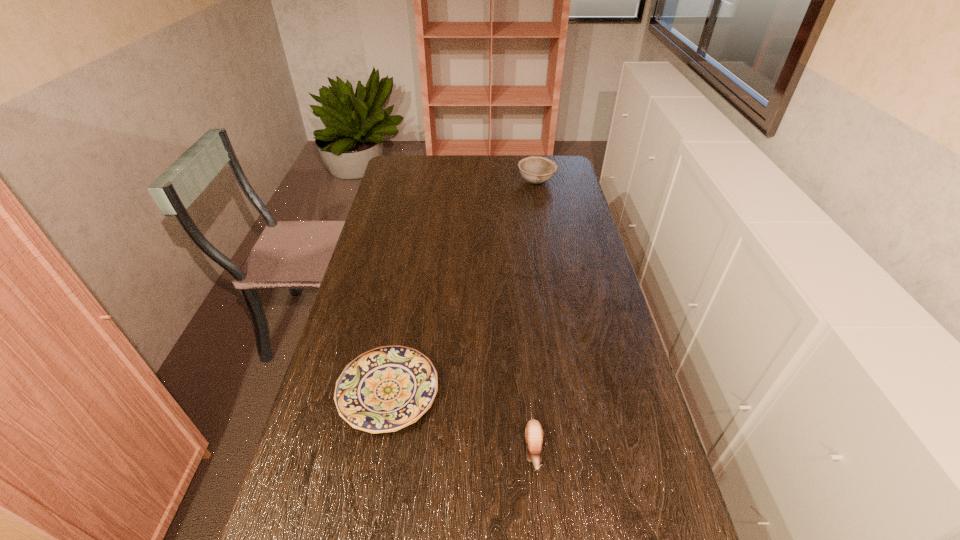
At what (x,y) coordinates should I click in order to perform the action: click on the tallest object. Please return your answer as a coordinate pair (x, y). This screenshot has width=960, height=540. Looking at the image, I should click on (537, 170).

The image size is (960, 540). In order to click on bowl in this screenshot , I will do `click(537, 170)`.

Locate an element on the screen. This screenshot has height=540, width=960. the second object from right to left is located at coordinates (533, 432).

Where is `the second shortest object`? This screenshot has height=540, width=960. the second shortest object is located at coordinates (533, 432).

What are the coordinates of `the shortest object` in the screenshot? It's located at (385, 389).

Find the location of a particular element. This screenshot has width=960, height=540. plate is located at coordinates (385, 389).

Locate an element on the screen. The height and width of the screenshot is (540, 960). vacant space positioned on the left of the farthest object is located at coordinates (440, 182).

In order to click on vacant space located 0.100m on the front-facing side of the second shortest object in this screenshot , I will do `click(540, 527)`.

Locate an element on the screen. The image size is (960, 540). blank space located on the right of the leftmost object is located at coordinates (546, 392).

At what (x,y) coordinates should I click in order to perform the action: click on object that is at the far edge. Please return your answer as a coordinate pair (x, y). This screenshot has height=540, width=960. Looking at the image, I should click on (537, 170).